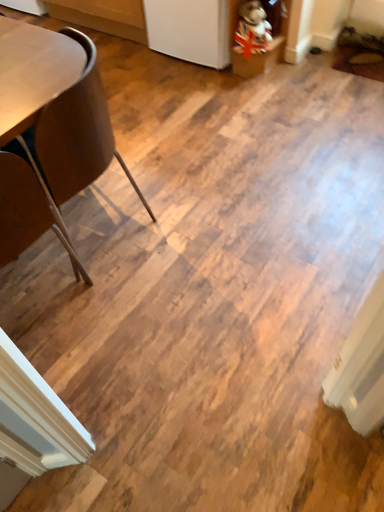
You are a GUI agent. You are given a task and a screenshot of the screen. Output one action in this format:
    pyautogui.click(x=<x>, y=<y>)
    Task: Click on the spots to the right of brown leather chair at left, acting as the 2th chair starting from the top
    The height and width of the screenshot is (512, 384).
    Given the screenshot: What is the action you would take?
    pyautogui.click(x=115, y=309)